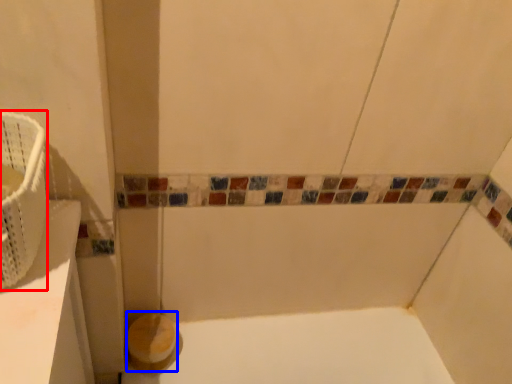
Question: Which object is further to the camera taking this photo, basket (highlighted by a red box) or toilet paper (highlighted by a blue box)?

Choices:
 (A) basket
 (B) toilet paper

Answer: (B)